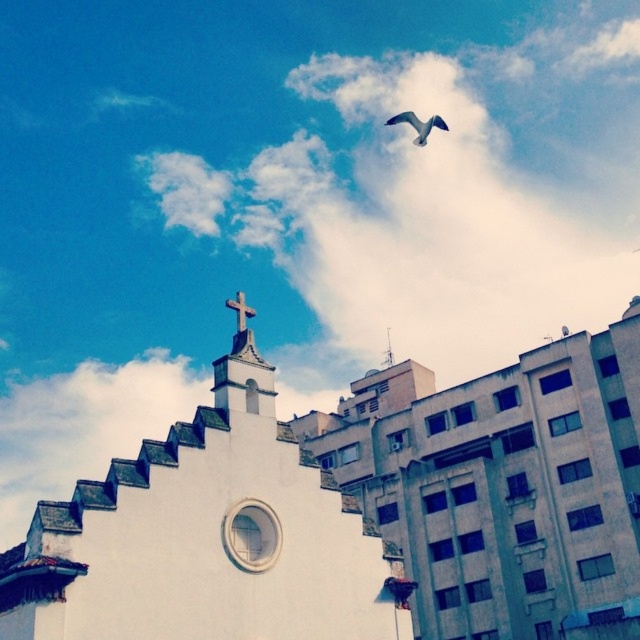
You are an architect analyzing the composition of the image. You notice the white fluffy cloud at upper center and the white wooden cross at upper center. Which one is located to the right of the other?

The white fluffy cloud at upper center is positioned on the right side of white wooden cross at upper center.

You are a drone operator who needs to fly a drone between the white matte church at upper center and the gray feathered bird at upper center. What is the minimum distance the drone must cover to navigate between them?

The minimum distance the drone must cover to navigate between the white matte church at upper center and the gray feathered bird at upper center is 160.92 feet.

You are an architect analyzing the spatial relationship between the white matte church at upper center and the gray feathered bird at upper center in the image. Based on the scene, which object is positioned higher in the sky?

The gray feathered bird at upper center is positioned higher in the sky than the white matte church at upper center because the church is below the bird.